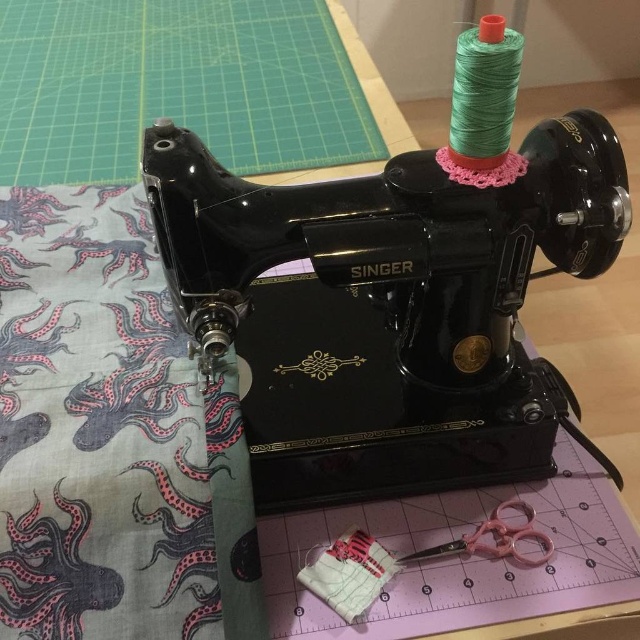
What object is located at the coordinates point [401,284]?

The point [401,284] marks the location of the black glossy singer sewing machine at center.

You are a tailor trying to reach the pink plastic scissors at lower center while standing at the sewing machine. Can you easily reach them without moving your chair? The black glossy singer sewing machine at center is between you and the scissors.

The black glossy singer sewing machine at center is closer to the viewer than the pink plastic scissors at lower center, so the scissors are further away. You might need to adjust your position or move the machine to reach them comfortably.

You are a photographer trying to capture the sewing machine and fabric setup. You notice two points marked at coordinates point (385, 291) and point (493, 509). Which point is closer to the camera?

Point (385, 291) is further to the camera than point (493, 509), so the point closer to the camera is point (493, 509).